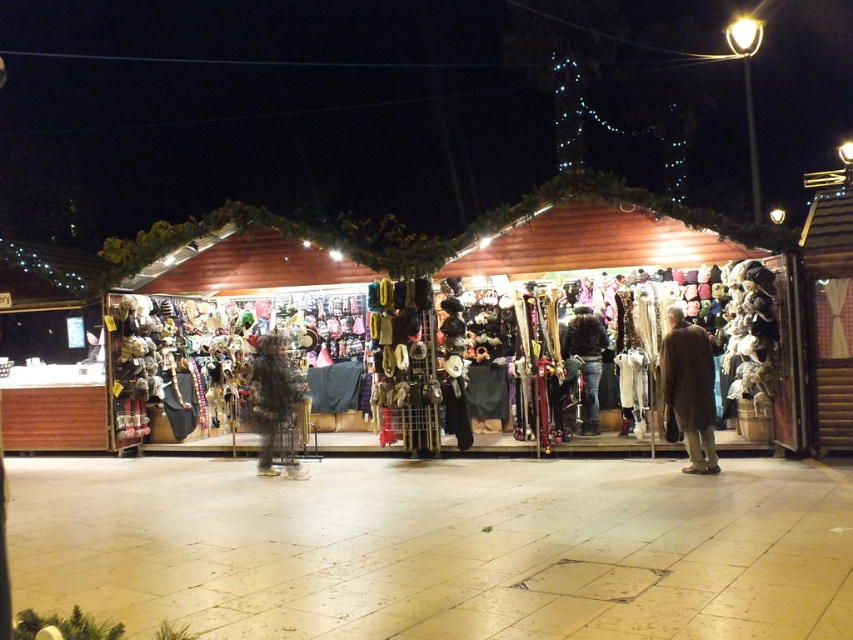
Is the position of fuzzy fabric coat at center more distant than that of dark brown leather jacket at center?

No.

Describe the element at coordinates (271, 397) in the screenshot. The width and height of the screenshot is (853, 640). I see `fuzzy fabric coat at center` at that location.

This screenshot has width=853, height=640. Describe the element at coordinates (271, 397) in the screenshot. I see `fuzzy fabric coat at center` at that location.

Find the location of `fuzzy fabric coat at center`. fuzzy fabric coat at center is located at coordinates (271, 397).

Does brown wool coat at right appear on the right side of dark brown leather jacket at center?

Indeed, brown wool coat at right is positioned on the right side of dark brown leather jacket at center.

Based on the photo, does brown wool coat at right appear on the left side of dark brown leather jacket at center?

In fact, brown wool coat at right is to the right of dark brown leather jacket at center.

Between point (703, 403) and point (596, 428), which one is positioned in front?

Point (703, 403) is more forward.

The width and height of the screenshot is (853, 640). Find the location of `brown wool coat at right`. brown wool coat at right is located at coordinates (689, 388).

Consider the image. Who is higher up, brown wool coat at right or fuzzy fabric coat at center?

brown wool coat at right is higher up.

Does point (694, 376) lie in front of point (259, 376)?

Yes, point (694, 376) is in front of point (259, 376).

Which is in front, point (689, 404) or point (265, 344)?

Point (689, 404)

Find the location of a particular element. brown wool coat at right is located at coordinates point(689,388).